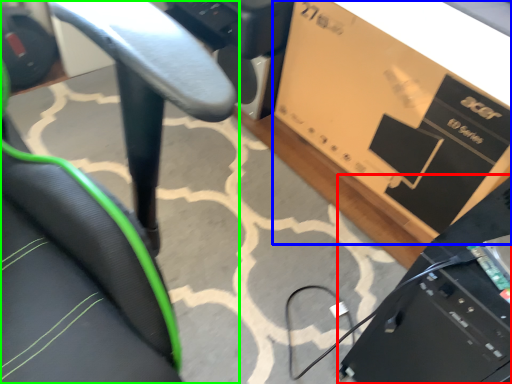
Question: Estimate the real-world distances between objects in this image. Which object is farther from computer (highlighted by a red box), cardboard box (highlighted by a blue box) or chair (highlighted by a green box)?

Choices:
 (A) cardboard box
 (B) chair

Answer: (A)